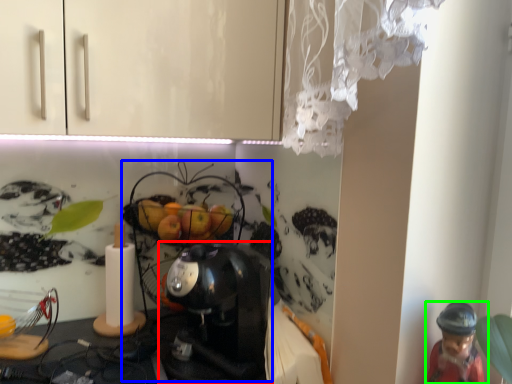
Question: Based on their relative distances, which object is farther from coffee maker (highlighted by a red box)? Choose from toy (highlighted by a blue box) and person (highlighted by a green box).

Choices:
 (A) toy
 (B) person

Answer: (B)